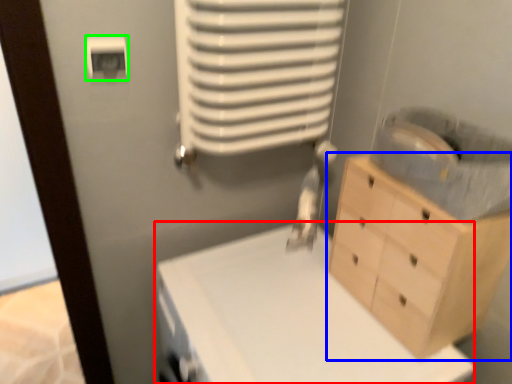
Question: Based on their relative distances, which object is nearer to changing table (highlighted by a red box)? Choose from chest of drawers (highlighted by a blue box) and light switch (highlighted by a green box).

Choices:
 (A) chest of drawers
 (B) light switch

Answer: (A)